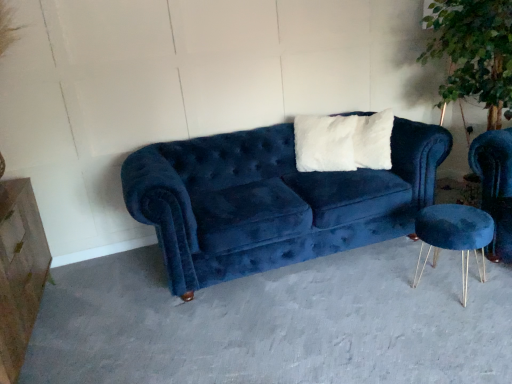
In order to click on vacant area that lies in front of velvet blue stool at lower right in this screenshot , I will do `click(463, 322)`.